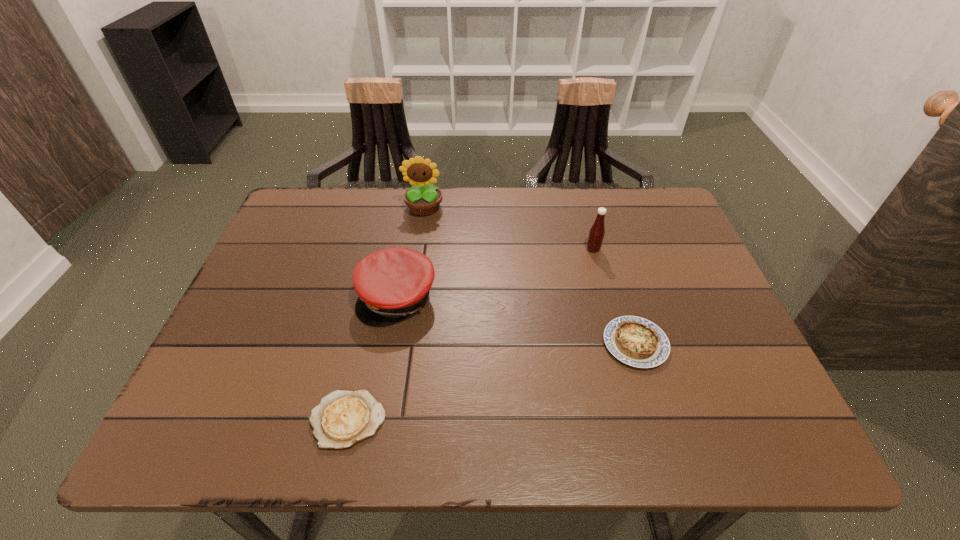
Where is `free spot at the right edge of the desktop`? This screenshot has height=540, width=960. free spot at the right edge of the desktop is located at coordinates (736, 380).

Where is `vacant space at the far left corner of the desktop`? The image size is (960, 540). vacant space at the far left corner of the desktop is located at coordinates (301, 205).

You are a GUI agent. You are given a task and a screenshot of the screen. Output one action in this format:
    pyautogui.click(x=<x>, y=<y>)
    Task: Click on the vacant space at the near left corner
    The image size is (960, 540).
    Given the screenshot: What is the action you would take?
    pyautogui.click(x=240, y=433)

This screenshot has height=540, width=960. What are the coordinates of `free region at the far right corner of the desktop` in the screenshot? It's located at (653, 225).

Image resolution: width=960 pixels, height=540 pixels. What are the coordinates of `vacant space at the near right corner` in the screenshot? It's located at (696, 426).

Locate an element on the screen. Image resolution: width=960 pixels, height=540 pixels. empty space between the third shortest object and the Tabasco sauce is located at coordinates (495, 273).

Where is `blank region between the fourth nearest object and the taller quiche`? The height and width of the screenshot is (540, 960). blank region between the fourth nearest object and the taller quiche is located at coordinates (614, 296).

I want to click on unoccupied area between the nearest object and the third tallest object, so click(372, 359).

Where is `free space between the fourth tallest object and the nearest object`? free space between the fourth tallest object and the nearest object is located at coordinates (492, 381).

This screenshot has width=960, height=540. Find the location of `vacant area that lies between the cap and the shortest object`. vacant area that lies between the cap and the shortest object is located at coordinates (372, 359).